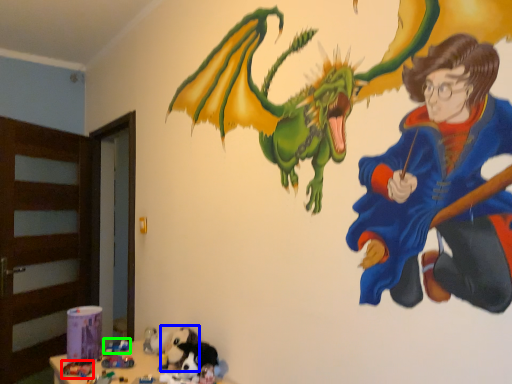
Question: Which is nearer to the toy (highlighted by a red box)? animal (highlighted by a blue box) or toy (highlighted by a green box).

Choices:
 (A) animal
 (B) toy

Answer: (B)